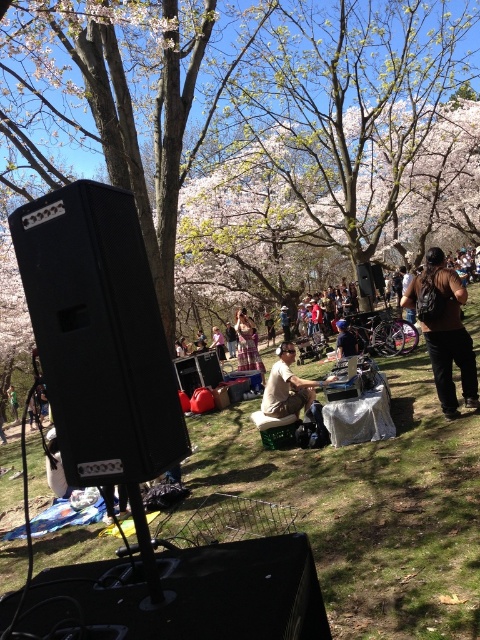
Is the position of green grass at center less distant than that of blue denim jeans at center?

Yes, it is in front of blue denim jeans at center.

Between green grass at center and blue denim jeans at center, which one has less height?

blue denim jeans at center

Is point (267, 484) positioned in front of point (338, 340)?

Yes.

Where is `green grass at center`? This screenshot has height=640, width=480. green grass at center is located at coordinates point(370,508).

Does khaki cotton shirt at center appear on the right side of matte pink dress at center?

Correct, you'll find khaki cotton shirt at center to the right of matte pink dress at center.

Between khaki cotton shirt at center and matte pink dress at center, which one is positioned higher?

khaki cotton shirt at center

Identify the location of khaki cotton shirt at center. This screenshot has width=480, height=640. (x=288, y=387).

Where is `khaki cotton shirt at center`? This screenshot has width=480, height=640. khaki cotton shirt at center is located at coordinates (288, 387).

Between green grass at center and matte pink dress at center, which one has more height?

With more height is green grass at center.

Between green grass at center and matte pink dress at center, which one appears on the right side from the viewer's perspective?

From the viewer's perspective, green grass at center appears more on the right side.

Locate an element on the screen. green grass at center is located at coordinates (370, 508).

Find the location of a particular element. green grass at center is located at coordinates (370, 508).